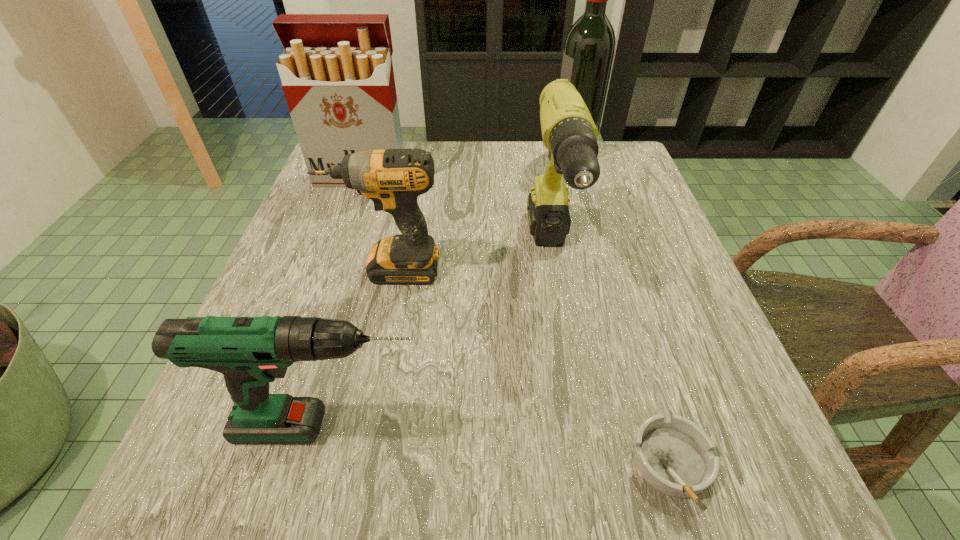
I want to click on ashtray present at the right edge, so click(x=674, y=455).

Where is `object that is at the far left corner`? The width and height of the screenshot is (960, 540). object that is at the far left corner is located at coordinates [337, 76].

Locate an element on the screen. object that is at the near left corner is located at coordinates (250, 352).

At what (x,y) coordinates should I click in order to perform the action: click on object at the far right corner. Please return your answer as a coordinate pair (x, y). Looking at the image, I should click on (588, 54).

This screenshot has width=960, height=540. I want to click on object that is at the near right corner, so click(674, 455).

In the image, there is a desktop. Where is `vacant space at the far edge`? The height and width of the screenshot is (540, 960). vacant space at the far edge is located at coordinates (534, 183).

I want to click on free space at the near edge of the desktop, so click(x=444, y=495).

Identify the location of free space at the left edge. This screenshot has height=540, width=960. (301, 396).

In order to click on free space at the right edge of the desktop in this screenshot , I will do `click(736, 427)`.

Find the location of a particular element. This screenshot has height=540, width=960. blank space at the near left corner of the desktop is located at coordinates (249, 502).